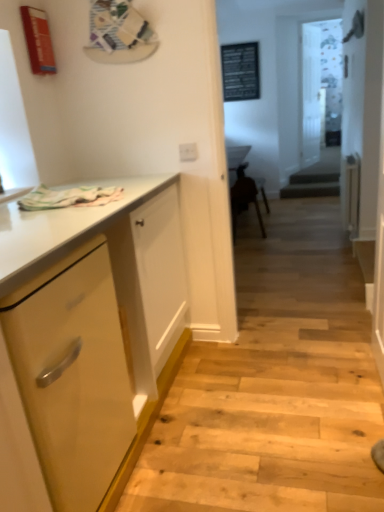
Question: Is transparent glass door at center, which appears as the 2th glass door when viewed from the back, with brown wooden chair at center?

Choices:
 (A) no
 (B) yes

Answer: (A)

Question: Can you confirm if transparent glass door at center, which appears as the 2th glass door when viewed from the back, is wider than brown wooden chair at center?

Choices:
 (A) no
 (B) yes

Answer: (A)

Question: Is brown wooden chair at center a part of transparent glass door at center, the 1th glass door in the front-to-back sequence?

Choices:
 (A) no
 (B) yes

Answer: (A)

Question: From a real-world perspective, does transparent glass door at center, which appears as the 2th glass door when viewed from the back, stand above brown wooden chair at center?

Choices:
 (A) yes
 (B) no

Answer: (A)

Question: Does transparent glass door at center, which appears as the 2th glass door when viewed from the back, lie in front of brown wooden chair at center?

Choices:
 (A) no
 (B) yes

Answer: (A)

Question: Does transparent glass door at center, which appears as the 2th glass door when viewed from the back, appear on the left side of brown wooden chair at center?

Choices:
 (A) yes
 (B) no

Answer: (B)

Question: Can you confirm if transparent glass door at center, which is the first glass door in back-to-front order, is shorter than brown wooden chair at center?

Choices:
 (A) no
 (B) yes

Answer: (A)

Question: Does transparent glass door at center, which appears as the 2th glass door when viewed from the front, turn towards brown wooden chair at center?

Choices:
 (A) yes
 (B) no

Answer: (B)

Question: Is transparent glass door at center, which is the first glass door in back-to-front order, bigger than brown wooden chair at center?

Choices:
 (A) no
 (B) yes

Answer: (A)

Question: Can you confirm if transparent glass door at center, which appears as the 2th glass door when viewed from the front, is thinner than brown wooden chair at center?

Choices:
 (A) yes
 (B) no

Answer: (A)

Question: Is transparent glass door at center, which is the first glass door in back-to-front order, placed right next to brown wooden chair at center?

Choices:
 (A) yes
 (B) no

Answer: (B)

Question: Considering the relative positions of transparent glass door at center, which appears as the 2th glass door when viewed from the front, and brown wooden chair at center in the image provided, is transparent glass door at center, which appears as the 2th glass door when viewed from the front, to the left of brown wooden chair at center from the viewer's perspective?

Choices:
 (A) no
 (B) yes

Answer: (A)

Question: Considering the relative sizes of white plastic electric outlet at upper center and transparent glass door at center, which appears as the 2th glass door when viewed from the back, in the image provided, is white plastic electric outlet at upper center shorter than transparent glass door at center, which appears as the 2th glass door when viewed from the back,?

Choices:
 (A) yes
 (B) no

Answer: (A)